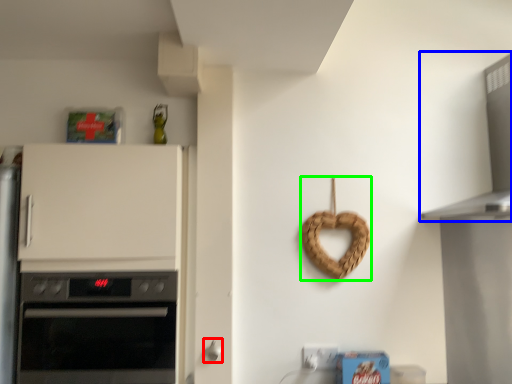
Question: Which object is the farthest from door handle (highlighted by a red box)? Choose among these: vent (highlighted by a blue box) or appliance (highlighted by a green box).

Choices:
 (A) vent
 (B) appliance

Answer: (A)